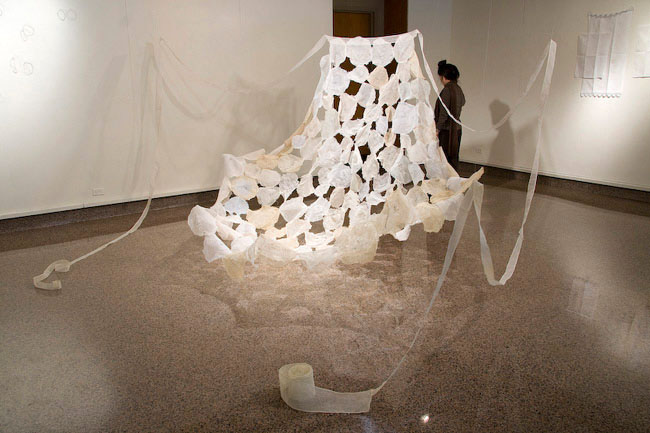
At what (x,y) coordinates should I click in order to perform the action: click on floor. Please return your answer as a coordinate pair (x, y). The height and width of the screenshot is (433, 650). Looking at the image, I should click on (494, 311).